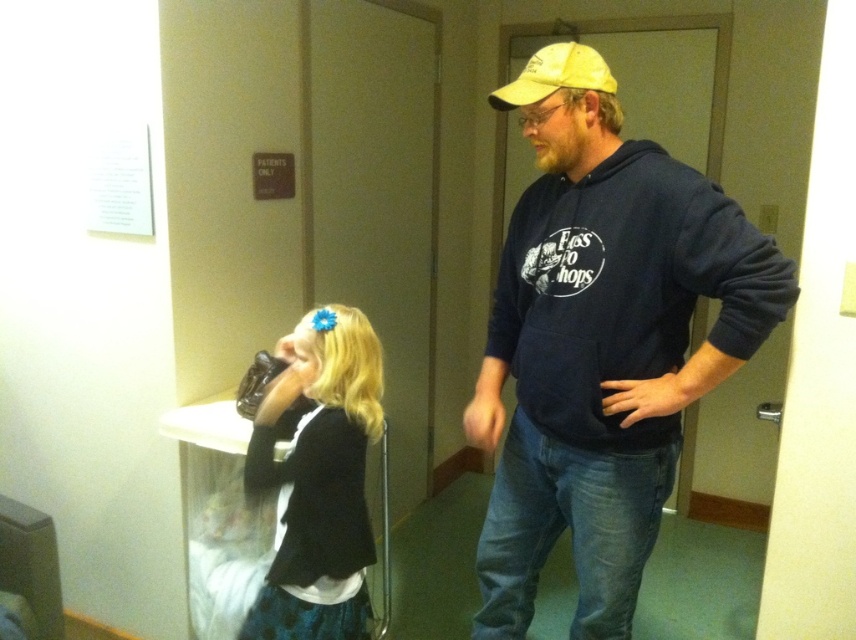
You are a security guard in the hallway and need to locate two items for a lost and found report. The items are the matte black jacket at center and the yellow fabric baseball cap at upper right. According to the scene, which item is positioned to the left of the other?

The matte black jacket at center is to the left of the yellow fabric baseball cap at upper right.

You are a delivery person who needs to place a package between the dark blue hoodie at center and the matte black jacket at center. The package measures 16 inches in length. Will there be enough space between them to fit the package?

The dark blue hoodie at center is 16.84 inches away from the matte black jacket at center. Since the package is 16 inches long, there is sufficient space to fit it between them.

You are a security guard in the hallway and need to locate the dark blue hoodie at center and the yellow fabric baseball cap at upper right. According to the scene, which object is positioned to the right of the other?

The dark blue hoodie at center is to the right of yellow fabric baseball cap at upper right.